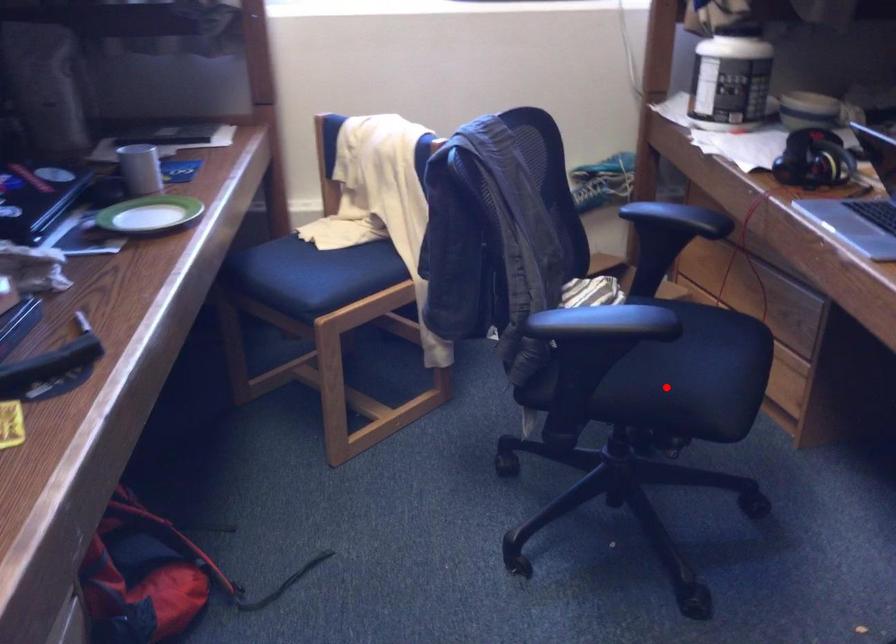
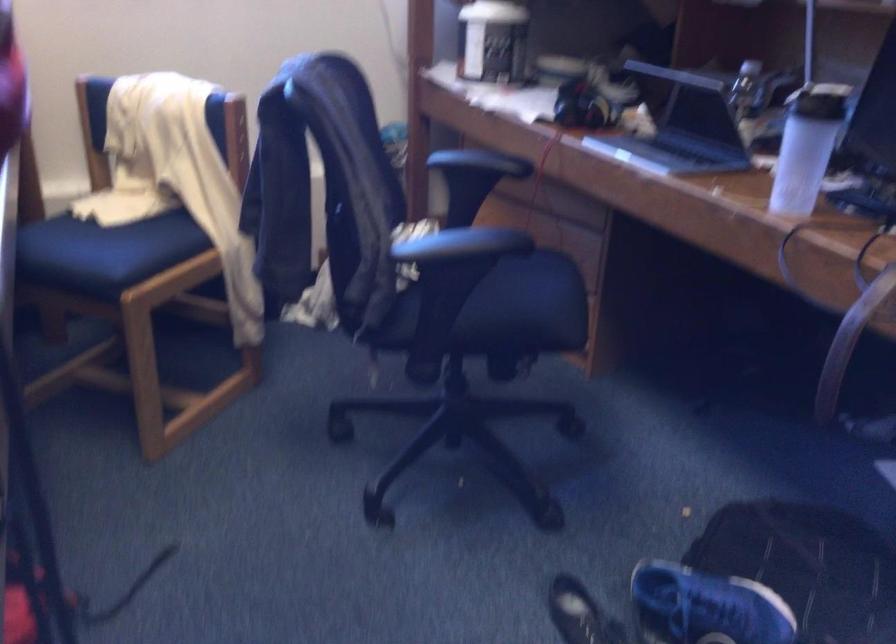
In the second image, find the point that corresponds to the highlighted location in the first image.

(515, 313)